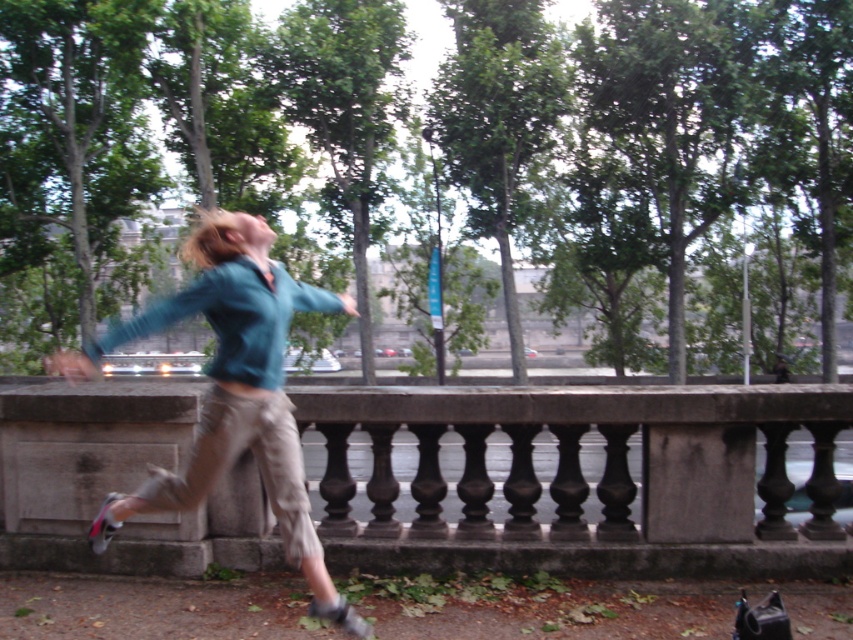
Question: Among these objects, which one is farthest from the camera?

Choices:
 (A) smooth stone railing at center
 (B) teal fabric shirt at center

Answer: (A)

Question: Can you confirm if smooth stone railing at center is thinner than teal fabric shirt at center?

Choices:
 (A) yes
 (B) no

Answer: (A)

Question: Does smooth stone railing at center appear on the right side of teal fabric shirt at center?

Choices:
 (A) no
 (B) yes

Answer: (B)

Question: Is smooth stone railing at center further to camera compared to teal fabric shirt at center?

Choices:
 (A) no
 (B) yes

Answer: (B)